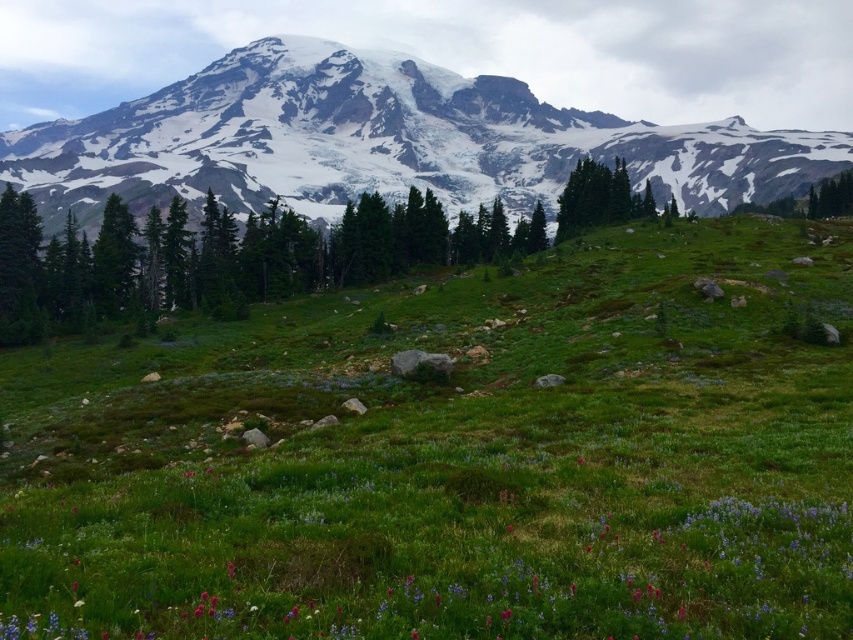
Question: Which object appears farthest from the camera in this image?

Choices:
 (A) purple matte flower at lower center
 (B) green grassy field at center
 (C) snowy granite mountain at upper center

Answer: (C)

Question: Estimate the real-world distances between objects in this image. Which object is farther from the green matte tree at center?

Choices:
 (A) purple matte flower at lower center
 (B) snowy granite mountain at upper center

Answer: (A)

Question: Does green matte tree at center appear on the right side of purple matte flower at lower center?

Choices:
 (A) yes
 (B) no

Answer: (B)

Question: Does green grassy field at center appear on the left side of purple matte flower at lower center?

Choices:
 (A) yes
 (B) no

Answer: (B)

Question: Among these points, which one is farthest from the camera?

Choices:
 (A) (374, 195)
 (B) (225, 566)
 (C) (635, 371)

Answer: (A)

Question: Does green grassy field at center appear on the left side of purple matte flower at lower center?

Choices:
 (A) yes
 (B) no

Answer: (B)